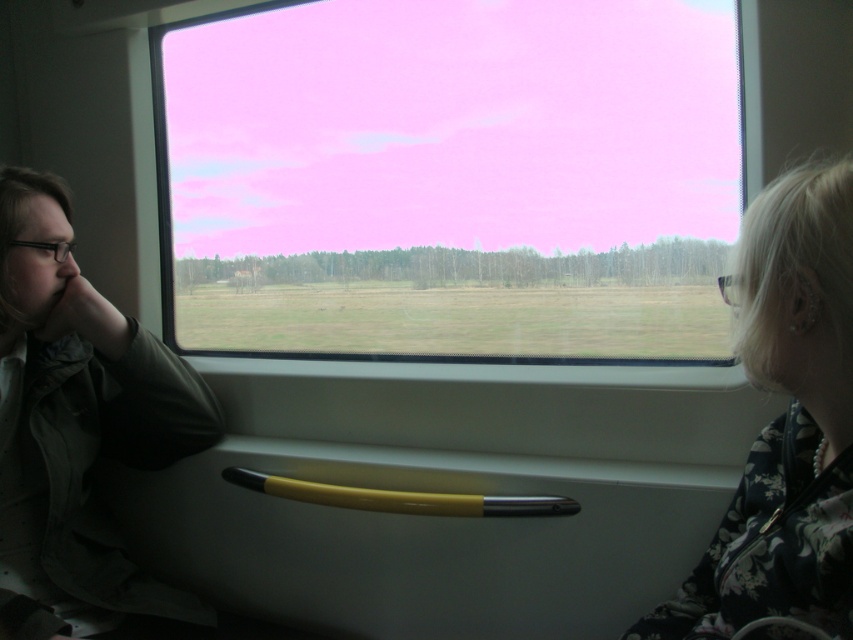
Is point (544, 120) positioned after point (9, 563)?

Yes, it is behind point (9, 563).

Which is in front, point (427, 104) or point (99, 403)?

Positioned in front is point (99, 403).

Find the location of a particular element. The width and height of the screenshot is (853, 640). transparent glass window at center is located at coordinates (454, 177).

Which of these two, transparent glass window at center or floral fabric jacket at right, stands shorter?

transparent glass window at center is shorter.

In the scene shown: Which is more to the left, transparent glass window at center or floral fabric jacket at right?

floral fabric jacket at right is more to the left.

Which is behind, point (666, 17) or point (776, 364)?

The point (666, 17) is more distant.

Image resolution: width=853 pixels, height=640 pixels. I want to click on transparent glass window at center, so click(x=454, y=177).

Is matte green jacket at left to the right of floral fabric jacket at right from the viewer's perspective?

Incorrect, matte green jacket at left is not on the right side of floral fabric jacket at right.

Is matte green jacket at left taller than floral fabric jacket at right?

Yes, matte green jacket at left is taller than floral fabric jacket at right.

Does point (44, 470) come in front of point (844, 364)?

No, (44, 470) is further to viewer.

Identify the location of matte green jacket at left. (76, 424).